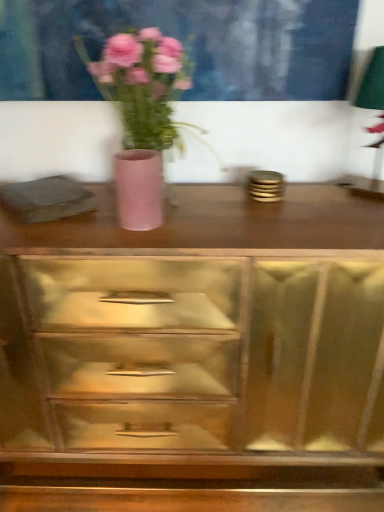
The height and width of the screenshot is (512, 384). What are the coordinates of `empty space that is to the right of pink matte vase at center` in the screenshot? It's located at (279, 215).